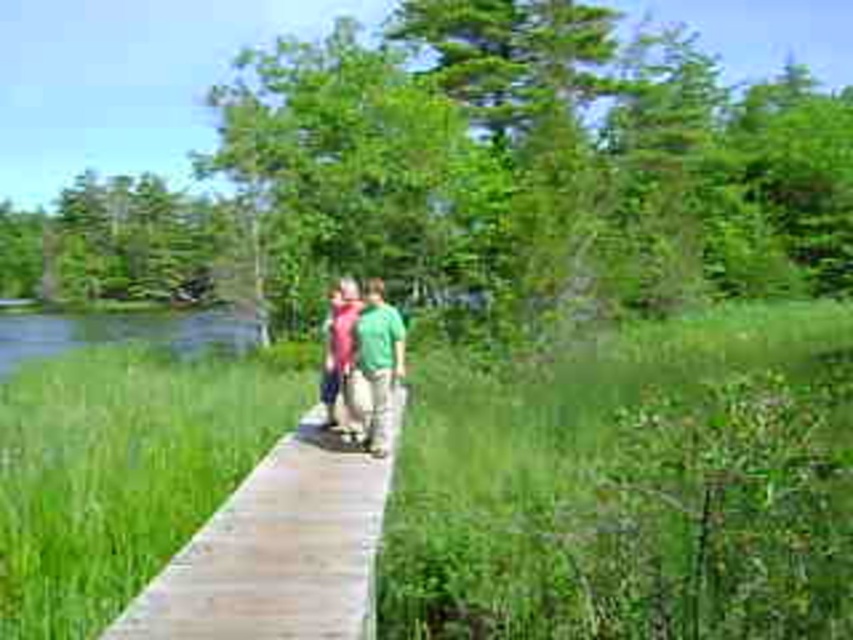
Who is shorter, wooden plank at center or matte pink sweater at center?

wooden plank at center

Between point (373, 518) and point (329, 426), which one is positioned in front?

Point (373, 518) is in front.

Does point (218, 634) come farther from viewer compared to point (347, 280)?

No, it is in front of (347, 280).

You are a GUI agent. You are given a task and a screenshot of the screen. Output one action in this format:
    pyautogui.click(x=<x>, y=<y>)
    Task: Click on the wooden plank at center
    The height and width of the screenshot is (640, 853).
    Given the screenshot: What is the action you would take?
    pyautogui.click(x=279, y=548)